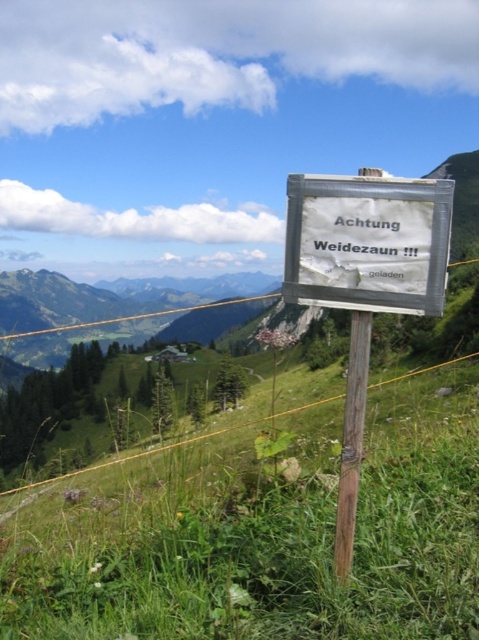
Question: Estimate the real-world distances between objects in this image. Which object is closer to the brown wooden pole at center?

Choices:
 (A) green grassy at center
 (B) white paper sign at center

Answer: (B)

Question: Considering the relative positions of white paper sign at center and brown wooden pole at center in the image provided, where is white paper sign at center located with respect to brown wooden pole at center?

Choices:
 (A) right
 (B) left

Answer: (B)

Question: Which of the following is the farthest from the observer?

Choices:
 (A) green grassy at center
 (B) white paper sign at center

Answer: (A)

Question: Does green grassy at center lie in front of white paper sign at center?

Choices:
 (A) no
 (B) yes

Answer: (A)

Question: Considering the real-world distances, which object is farthest from the white paper sign at center?

Choices:
 (A) green grassy at center
 (B) brown wooden pole at center

Answer: (A)

Question: Can you confirm if green grassy at center is positioned below brown wooden pole at center?

Choices:
 (A) yes
 (B) no

Answer: (A)